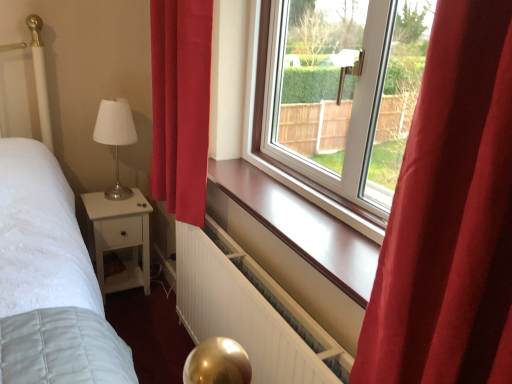
Question: Considering the positions of white satin table lamp at left and white matte radiator at lower center in the image, is white satin table lamp at left taller or shorter than white matte radiator at lower center?

Choices:
 (A) tall
 (B) short

Answer: (B)

Question: Do you think white satin table lamp at left is within white matte radiator at lower center, or outside of it?

Choices:
 (A) outside
 (B) inside

Answer: (A)

Question: Estimate the real-world distances between objects in this image. Which object is farther from the red velvet curtain at left?

Choices:
 (A) white satin table lamp at left
 (B) white matte nightstand at lower left
 (C) white matte radiator at lower center

Answer: (B)

Question: Estimate the real-world distances between objects in this image. Which object is closer to the white satin table lamp at left?

Choices:
 (A) white matte nightstand at lower left
 (B) white matte radiator at lower center
 (C) red velvet curtain at left

Answer: (A)